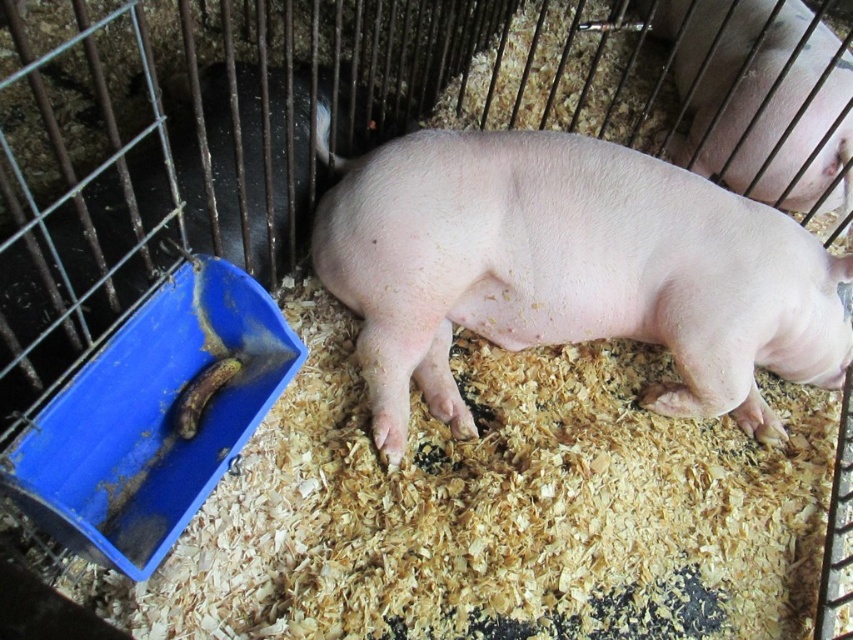
You are a farmer checking the health of the pig. You notice the pink smooth pig at center and the pink smooth skin at center. Which one is directly on top of the other?

The pink smooth skin at center is directly on top of the pink smooth pig at center.

You are a farmer checking the health of the animals. You notice the pink smooth pig at center and the pink smooth skin at center. Which one has a shorter height?

The pink smooth pig at center is not as tall as the pink smooth skin at center, so the pink smooth pig at center has a shorter height.

In the scene shown: You are a farmer checking the health of the animals. You notice the pink smooth pig at center and the pink smooth skin at center. Which one has a greater width?

The pink smooth pig at center has a greater width than the pink smooth skin at center.